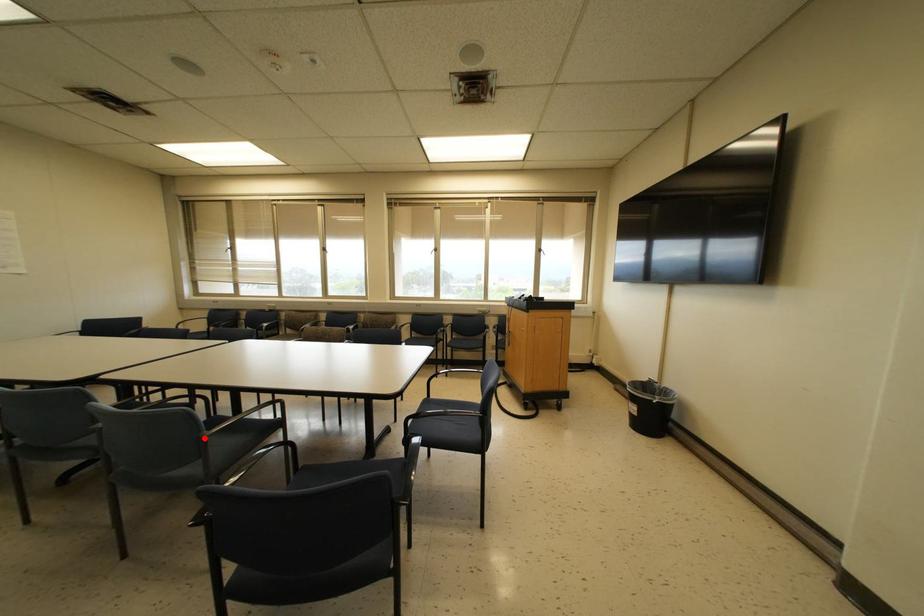
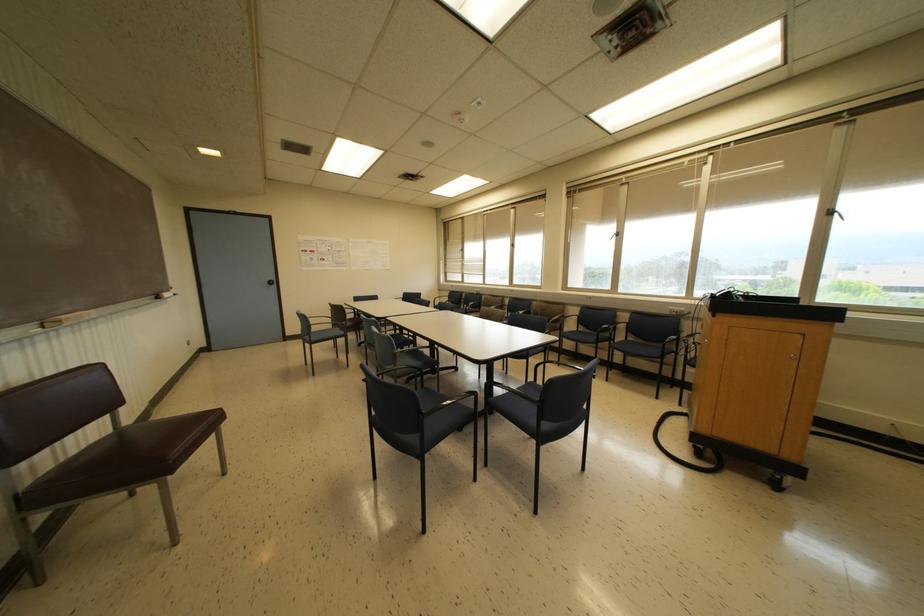
Question: I am providing you with two images of the same scene from different viewpoints. Given a red point in image1, look at the same physical point in image2. Is it:

Choices:
 (A) Closer to the viewpoint
 (B) Farther from the viewpoint

Answer: (A)